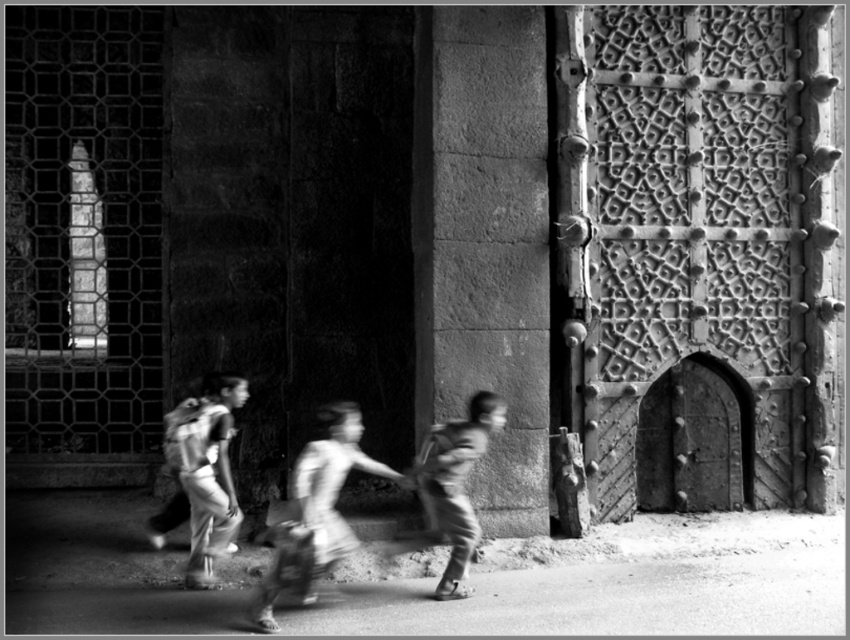
Question: Among these points, which one is farthest from the camera?

Choices:
 (A) (456, 436)
 (B) (302, 458)

Answer: (A)

Question: Can you confirm if rough stone pillar at center is bigger than matte backpack at center?

Choices:
 (A) yes
 (B) no

Answer: (A)

Question: Is rough stone pillar at center wider than smooth skin boy at center?

Choices:
 (A) yes
 (B) no

Answer: (A)

Question: Which object is positioned closest to the rough stone pillar at center?

Choices:
 (A) smooth skin boy at center
 (B) smooth fabric bag at center
 (C) matte backpack at center

Answer: (A)

Question: Which object is closer to the camera taking this photo?

Choices:
 (A) rough stone pillar at center
 (B) smooth skin boy at center
 (C) smooth fabric bag at center

Answer: (C)

Question: Is smooth fabric bag at center thinner than smooth skin boy at center?

Choices:
 (A) no
 (B) yes

Answer: (A)